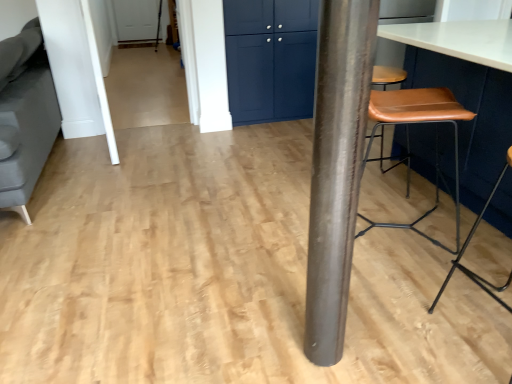
Where is `free region under brown leather stool at right (from a real-world perspective)`? This screenshot has width=512, height=384. free region under brown leather stool at right (from a real-world perspective) is located at coordinates (482, 327).